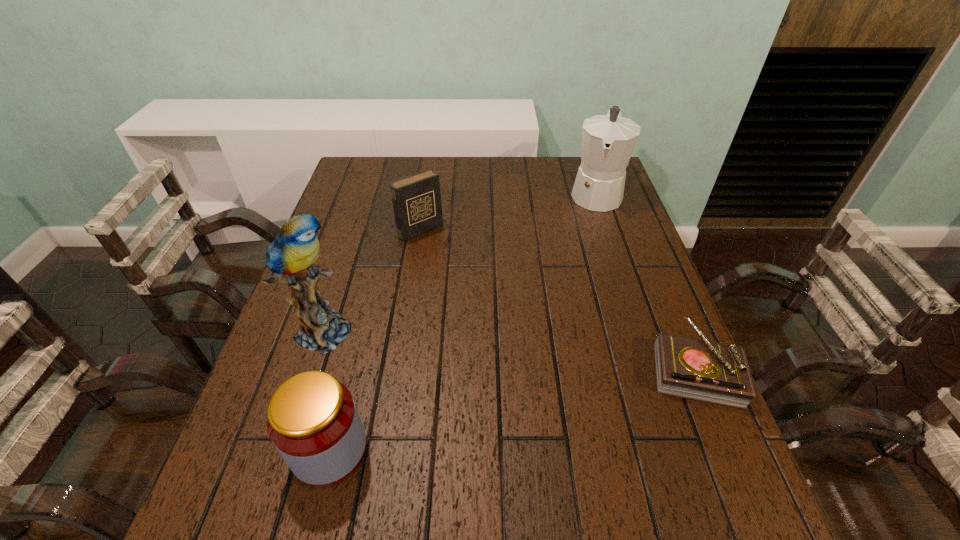
This screenshot has width=960, height=540. Find the location of `free space located on the face of the tallest object`. free space located on the face of the tallest object is located at coordinates (440, 359).

The image size is (960, 540). In order to click on free space located 0.190m on the face of the tallest object in this screenshot , I will do `click(431, 356)`.

Where is `free space located 0.370m on the face of the tallest object`? This screenshot has height=540, width=960. free space located 0.370m on the face of the tallest object is located at coordinates click(x=510, y=378).

Identify the location of blank area located at the spout of the second tallest object. This screenshot has width=960, height=540. (589, 245).

In order to click on free location located at the spout of the second tallest object in this screenshot , I will do `click(593, 226)`.

Where is `free space located at the spout of the second tallest object`? free space located at the spout of the second tallest object is located at coordinates click(588, 253).

Find the location of a particular element. vacant space situated 0.100m on the front cover of the fourth nearest object is located at coordinates (450, 259).

Locate an element on the screen. vacant space situated on the front cover of the fourth nearest object is located at coordinates (466, 275).

This screenshot has width=960, height=540. Identify the location of vacant space situated 0.270m on the front cover of the fourth nearest object. (486, 295).

This screenshot has height=540, width=960. I want to click on object located at the far edge, so point(608,141).